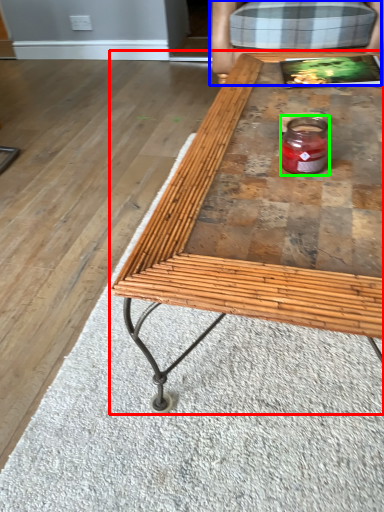
Question: Which object is positioned closest to coffee table (highlighted by a red box)? Select from armchair (highlighted by a blue box) and glass jar (highlighted by a green box).

Choices:
 (A) armchair
 (B) glass jar

Answer: (B)